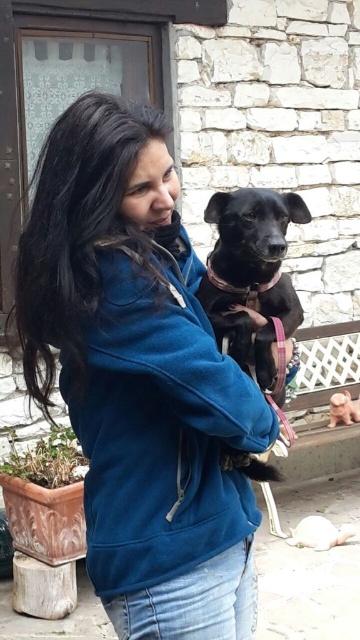
Question: Considering the relative positions of blue fleece jacket at center and black matte dog at center in the image provided, where is blue fleece jacket at center located with respect to black matte dog at center?

Choices:
 (A) below
 (B) above

Answer: (A)

Question: Does blue fleece jacket at center have a larger size compared to black matte dog at center?

Choices:
 (A) yes
 (B) no

Answer: (A)

Question: Which of the following is the farthest from the observer?

Choices:
 (A) blue fleece jacket at center
 (B) black matte dog at center

Answer: (B)

Question: Which point appears farthest from the camera in this image?

Choices:
 (A) (271, 257)
 (B) (38, 268)

Answer: (A)

Question: Can you confirm if blue fleece jacket at center is smaller than black matte dog at center?

Choices:
 (A) yes
 (B) no

Answer: (B)